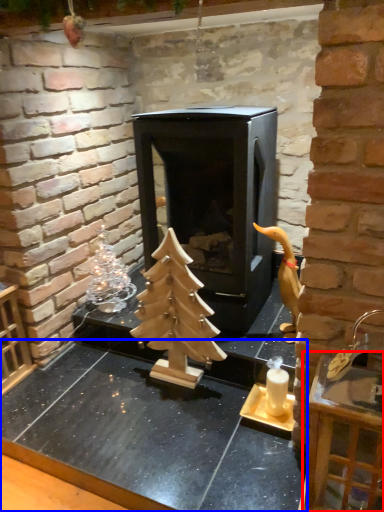
Question: Which object appears farthest to the camera in this image, furniture (highlighted by a red box) or counter top (highlighted by a blue box)?

Choices:
 (A) furniture
 (B) counter top

Answer: (B)